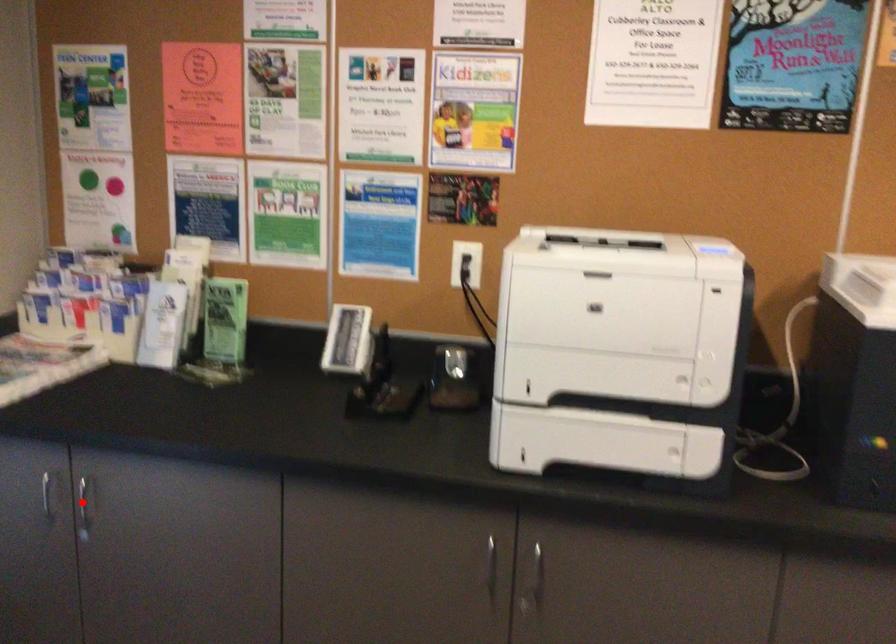
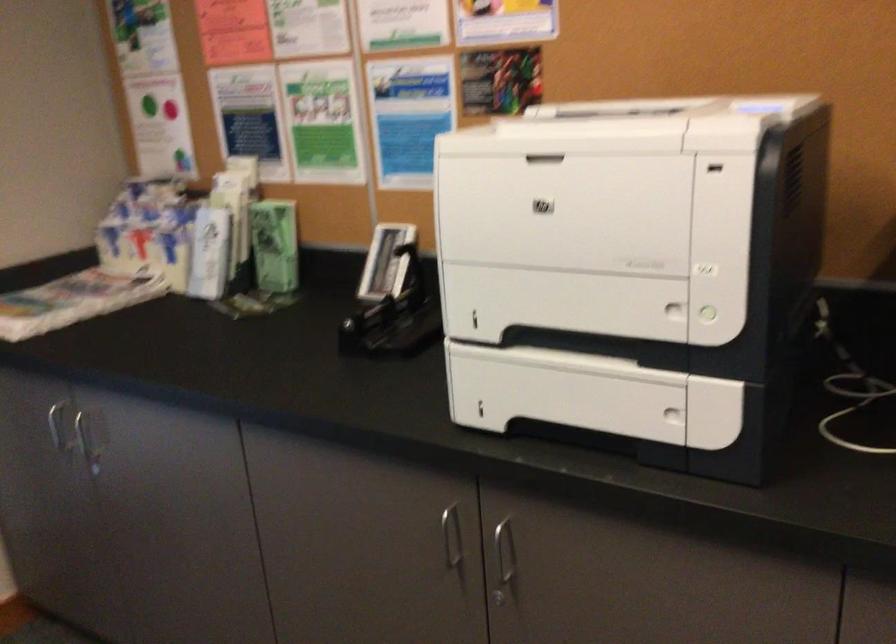
In the second image, find the point that corresponds to the highlighted location in the first image.

(89, 440)